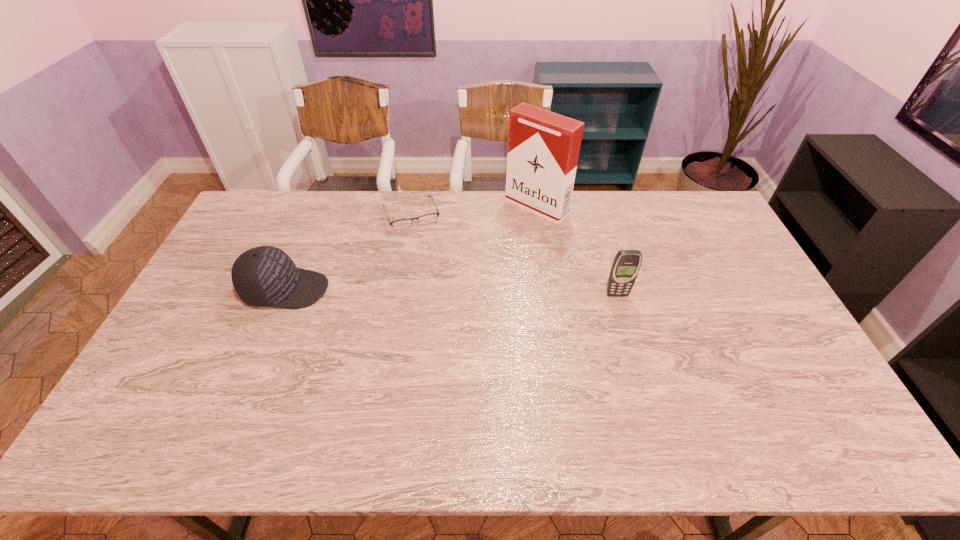
Where is `vacant region located 0.090m on the front-facing side of the third object from right to left`? The image size is (960, 540). vacant region located 0.090m on the front-facing side of the third object from right to left is located at coordinates (424, 247).

The width and height of the screenshot is (960, 540). What are the coordinates of `vacant space positioned on the front-facing side of the third object from right to left` in the screenshot? It's located at (440, 290).

You are a GUI agent. You are given a task and a screenshot of the screen. Output one action in this format:
    pyautogui.click(x=<x>, y=<y>)
    Task: Click on the free space located 0.370m on the front-facing side of the third object from right to left
    This screenshot has width=960, height=540.
    Given the screenshot: What is the action you would take?
    pyautogui.click(x=445, y=306)

Locate an element on the screen. vacant space located 0.320m on the front-facing side of the tallest object is located at coordinates (463, 269).

The width and height of the screenshot is (960, 540). I want to click on free location located 0.270m on the front-facing side of the tallest object, so click(x=472, y=261).

Where is `blank space located 0.290m on the front-facing side of the tallest object`? This screenshot has width=960, height=540. blank space located 0.290m on the front-facing side of the tallest object is located at coordinates (468, 264).

Identify the location of spectacles that is at the far edge. This screenshot has height=540, width=960. (400, 224).

In order to click on cigarette_case located at the far edge in this screenshot , I will do `click(543, 147)`.

Locate an element on the screen. object that is at the left edge is located at coordinates (265, 276).

Locate an element on the screen. vacant space at the far edge of the desktop is located at coordinates click(455, 215).